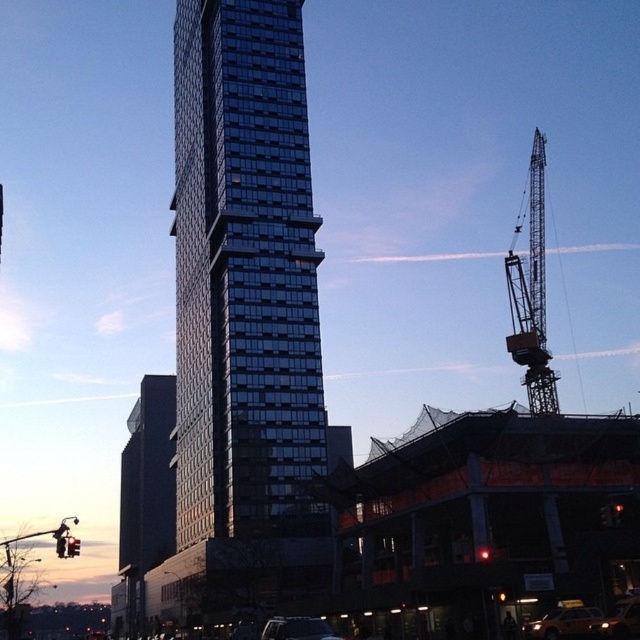
Question: Which of the following is the farthest from the observer?

Choices:
 (A) shiny silver car at lower right
 (B) metallic silver car at center
 (C) glassy reflective skyscraper at center
 (D) red glass traffic light at center

Answer: (C)

Question: Is glassy reflective skyscraper at center thinner than red glass traffic light at center?

Choices:
 (A) no
 (B) yes

Answer: (A)

Question: Is metallic silver car at center further to the viewer compared to red glass traffic light at left?

Choices:
 (A) yes
 (B) no

Answer: (A)

Question: Which object appears farthest from the camera in this image?

Choices:
 (A) red glass traffic light at left
 (B) shiny silver car at lower right
 (C) red glass traffic light at lower right
 (D) metallic silver car at center

Answer: (C)

Question: Can you confirm if red glass traffic light at lower right is positioned below metallic red traffic light at upper left?

Choices:
 (A) yes
 (B) no

Answer: (B)

Question: Which object is positioned closest to the glassy reflective skyscraper at center?

Choices:
 (A) metallic silver car at center
 (B) metallic gray crane at upper right
 (C) shiny silver car at lower right

Answer: (B)